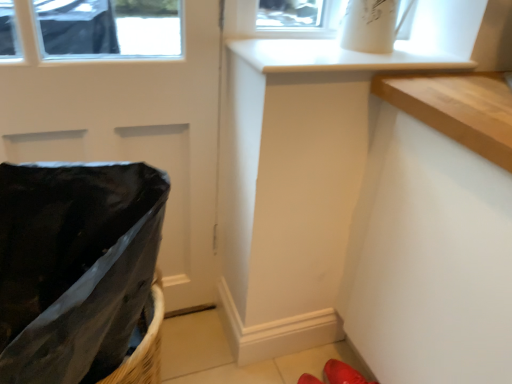
Question: Can you confirm if red rubber shoes at lower right is smaller than black plastic laundry basket at left?

Choices:
 (A) no
 (B) yes

Answer: (B)

Question: Does red rubber shoes at lower right turn towards black plastic laundry basket at left?

Choices:
 (A) yes
 (B) no

Answer: (B)

Question: Is red rubber shoes at lower right to the right of black plastic laundry basket at left from the viewer's perspective?

Choices:
 (A) yes
 (B) no

Answer: (A)

Question: Is the surface of red rubber shoes at lower right in direct contact with black plastic laundry basket at left?

Choices:
 (A) yes
 (B) no

Answer: (B)

Question: Can you confirm if red rubber shoes at lower right is positioned to the left of black plastic laundry basket at left?

Choices:
 (A) no
 (B) yes

Answer: (A)

Question: In terms of size, does glossy black door at left appear bigger or smaller than black plastic laundry basket at left?

Choices:
 (A) small
 (B) big

Answer: (A)

Question: From a real-world perspective, is glossy black door at left physically located above or below black plastic laundry basket at left?

Choices:
 (A) above
 (B) below

Answer: (A)

Question: In terms of height, does glossy black door at left look taller or shorter compared to black plastic laundry basket at left?

Choices:
 (A) short
 (B) tall

Answer: (B)

Question: Do you think glossy black door at left is within black plastic laundry basket at left, or outside of it?

Choices:
 (A) outside
 (B) inside

Answer: (A)

Question: Do you think red rubber shoes at lower right is within black plastic laundry basket at left, or outside of it?

Choices:
 (A) outside
 (B) inside

Answer: (A)

Question: Considering the relative positions of red rubber shoes at lower right and black plastic laundry basket at left in the image provided, is red rubber shoes at lower right to the left or to the right of black plastic laundry basket at left?

Choices:
 (A) left
 (B) right

Answer: (B)

Question: From a real-world perspective, is red rubber shoes at lower right physically located above or below black plastic laundry basket at left?

Choices:
 (A) below
 (B) above

Answer: (A)

Question: Based on their sizes in the image, would you say red rubber shoes at lower right is bigger or smaller than black plastic laundry basket at left?

Choices:
 (A) big
 (B) small

Answer: (B)

Question: Is glossy black door at left inside the boundaries of red rubber shoes at lower right, or outside?

Choices:
 (A) inside
 (B) outside

Answer: (B)

Question: Does point pos(194,195) appear closer or farther from the camera than point pos(337,359)?

Choices:
 (A) closer
 (B) farther

Answer: (A)